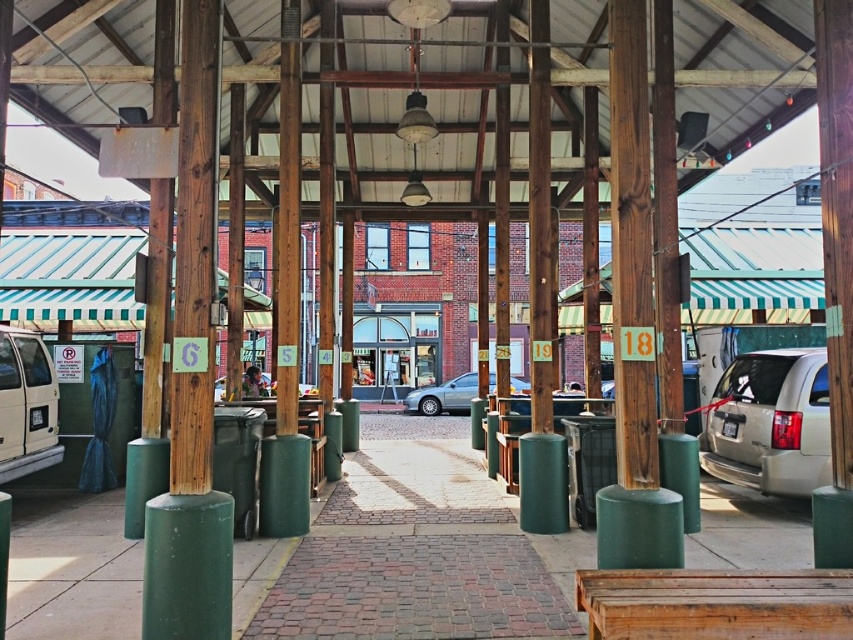
Question: Is brick pavement at center above matte white van at left?

Choices:
 (A) no
 (B) yes

Answer: (A)

Question: Can you confirm if brick pavement at center is positioned to the right of satin silver sedan at center?

Choices:
 (A) no
 (B) yes

Answer: (A)

Question: Estimate the real-world distances between objects in this image. Which object is closer to the brick pavement at center?

Choices:
 (A) matte white van at left
 (B) satin silver sedan at center

Answer: (A)

Question: Which point is farther to the camera?

Choices:
 (A) matte white van at left
 (B) satin silver sedan at center
 (C) brick pavement at center

Answer: (B)

Question: Where is matte white van at left located in relation to satin silver sedan at center in the image?

Choices:
 (A) above
 (B) below

Answer: (A)

Question: Which object appears closest to the camera in this image?

Choices:
 (A) satin silver sedan at center
 (B) silver metallic minivan at right
 (C) matte white van at left

Answer: (B)